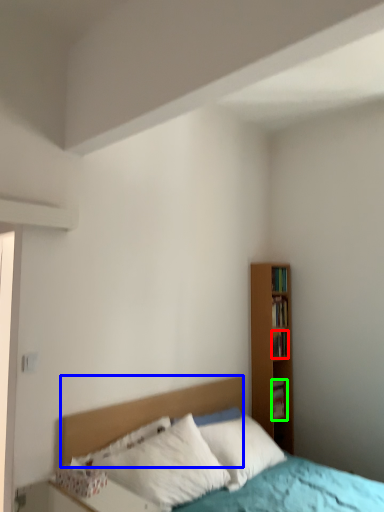
Question: Which object is positioned farthest from book (highlighted by a red box)? Select from headboard (highlighted by a blue box) and book (highlighted by a green box).

Choices:
 (A) headboard
 (B) book

Answer: (A)